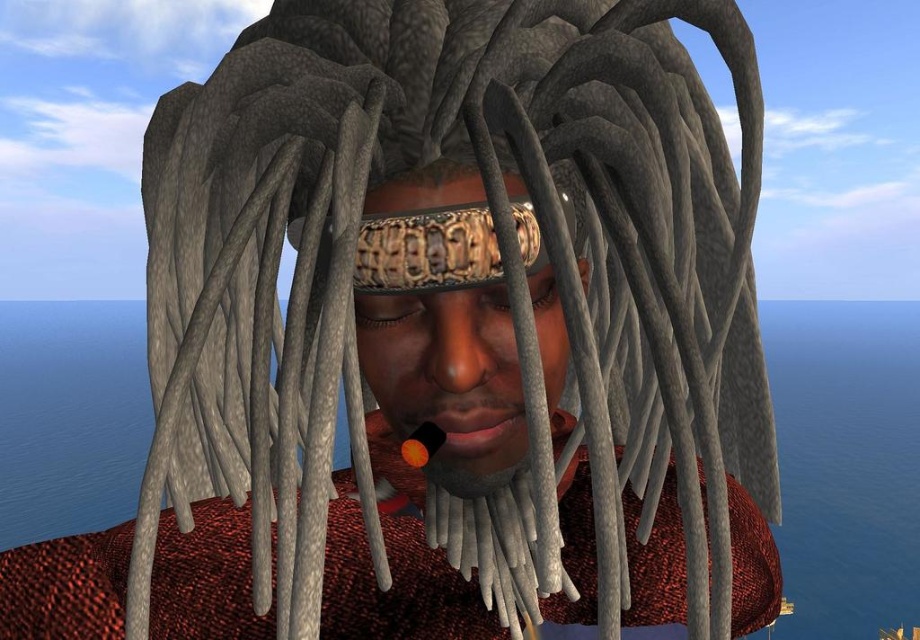
Who is positioned more to the left, textured gray dreadlocks at center or metallic gold headband at center?

textured gray dreadlocks at center is more to the left.

Between textured gray dreadlocks at center and metallic gold headband at center, which one appears on the right side from the viewer's perspective?

metallic gold headband at center

Who is more distant from viewer, (305, 212) or (372, 317)?

The point (372, 317) is more distant.

Locate an element on the screen. Image resolution: width=920 pixels, height=640 pixels. textured gray dreadlocks at center is located at coordinates (516, 291).